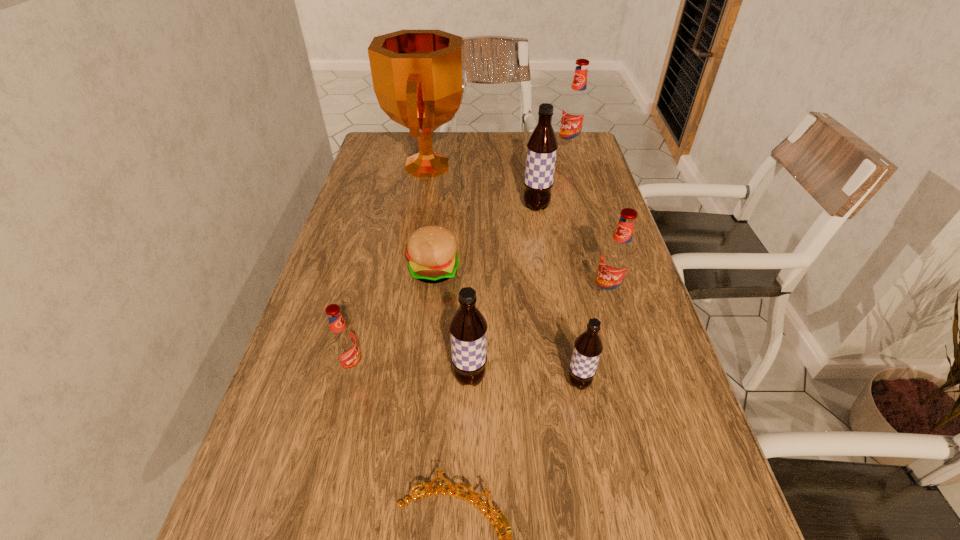
Identify the location of vacant space at the right edge of the desktop. (653, 525).

Locate an element on the screen. The width and height of the screenshot is (960, 540). free point at the far left corner is located at coordinates (407, 139).

Identify the location of free spot between the leftmost brown root beer and the farthest brown root beer. This screenshot has height=540, width=960. (503, 292).

What are the coordinates of `vacant space that is in between the biggest red root beer and the tallest object` in the screenshot? It's located at (499, 159).

Where is `empty space between the leftmost red root beer and the second biggest brown root beer`? empty space between the leftmost red root beer and the second biggest brown root beer is located at coordinates (411, 373).

I want to click on free spot between the leftmost root beer and the tallest object, so click(x=391, y=267).

Locate an element on the screen. The height and width of the screenshot is (540, 960). vacant point located between the smallest brown root beer and the award is located at coordinates (504, 274).

Find the location of a particular element. vacant region between the leftmost red root beer and the farthest brown root beer is located at coordinates (444, 288).

Where is `vacant space that is in between the smallest brown root beer and the beige hamburger`? The image size is (960, 540). vacant space that is in between the smallest brown root beer and the beige hamburger is located at coordinates pos(507,326).

Where is `object that is the third closest to the nearest object`? This screenshot has width=960, height=540. object that is the third closest to the nearest object is located at coordinates (343, 342).